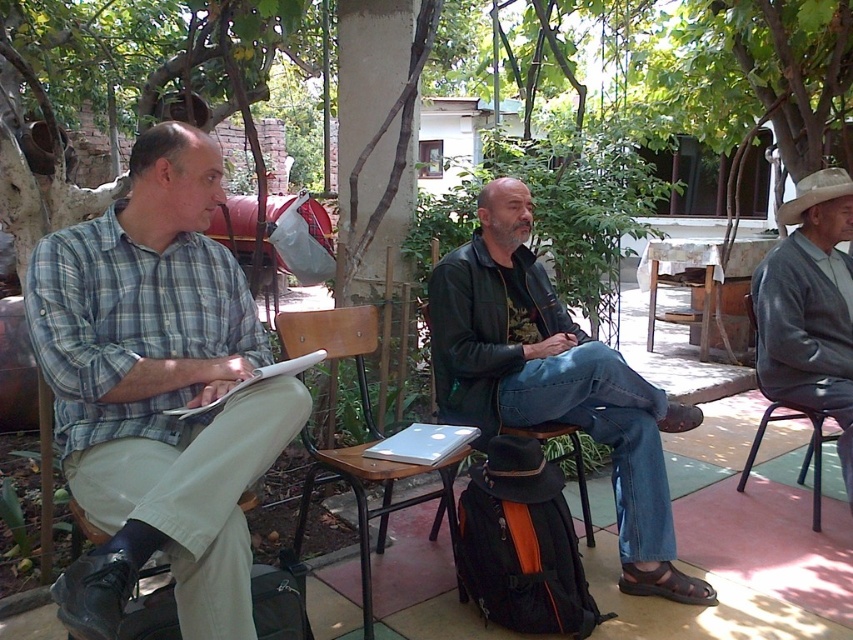
You are a photographer positioned at the origin point. You need to capture a photo of the gray woolen sweater at right. Which direction should you move to get closer to the sweater?

The gray woolen sweater at right is located at point 0.481 on the x and 0.950 on the y. Since you are at the origin, you should move towards the right and upwards to reach the sweater.

You are trying to decide whether to place a new decorative item on either the gray woolen sweater at right or the wooden chair at center. Based on their widths, which object would be more suitable for placing a wider item?

The wooden chair at center has a greater width than the gray woolen sweater at right, so placing a wider item would be more suitable on the wooden chair at center.

Based on the scene described, which object is taller when comparing the leather jacket at center and the wooden chair at center?

The leather jacket at center is taller than the wooden chair at center according to the description.